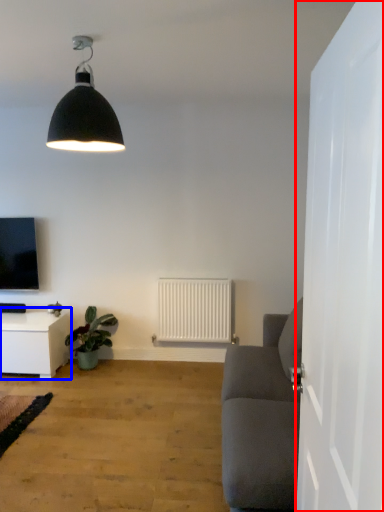
Question: Which object is closer to the camera taking this photo, door (highlighted by a red box) or table (highlighted by a blue box)?

Choices:
 (A) door
 (B) table

Answer: (A)